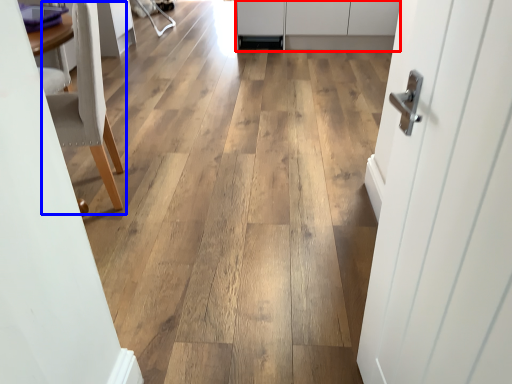
Question: Which of the following is the closest to the observer, cabinetry (highlighted by a red box) or chair (highlighted by a blue box)?

Choices:
 (A) cabinetry
 (B) chair

Answer: (B)